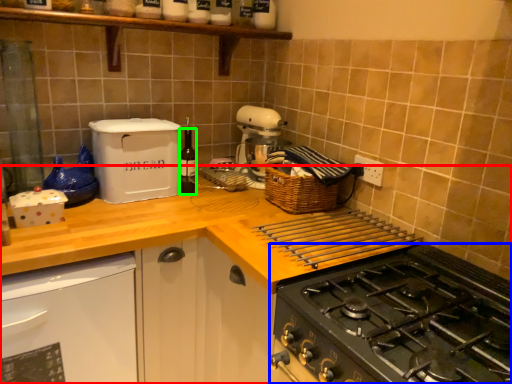
Question: Estimate the real-world distances between objects in this image. Which object is farther from countertop (highlighted by a red box), gas stove (highlighted by a blue box) or bottle (highlighted by a green box)?

Choices:
 (A) gas stove
 (B) bottle

Answer: (B)